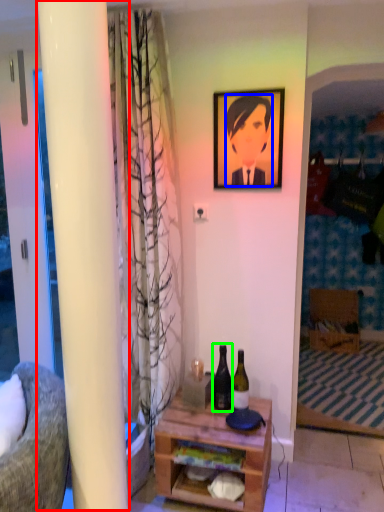
Question: Which object is the farthest from pillar (highlighted by a red box)? Choose among these: person (highlighted by a blue box) or bottle (highlighted by a green box).

Choices:
 (A) person
 (B) bottle

Answer: (A)